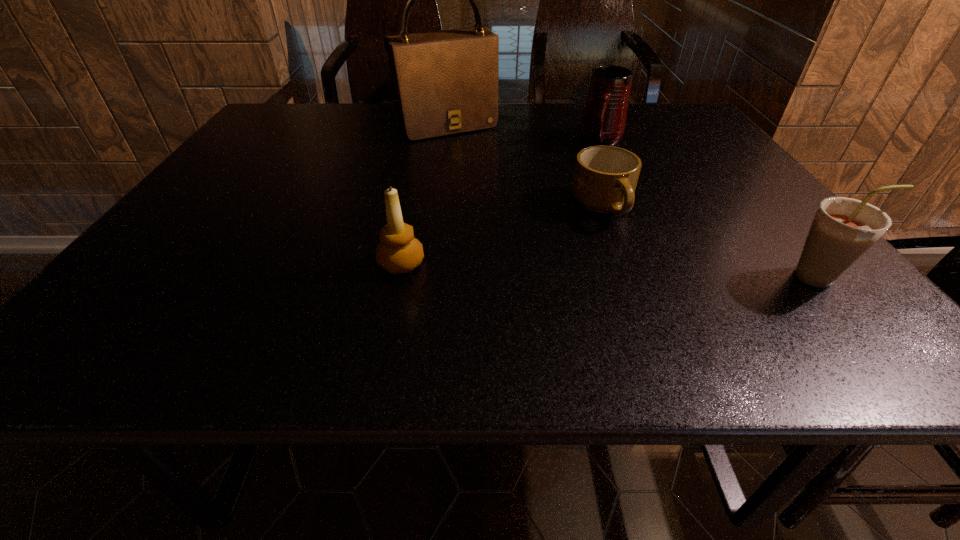
Locate an element on the screen. free space on the desktop that is between the candle_holder and the rightmost object and is positioned on the side of the taller mug with the handle is located at coordinates pyautogui.click(x=550, y=268).

Identify the location of vacant space on the desktop that is between the candle_holder and the rightmost object and is positioned on the side with the handle of the shorter mug. This screenshot has height=540, width=960. (630, 271).

Identify the location of free space on the desktop that is between the candle_holder and the rightmost object and is positioned on the front flap of the shoulder bag. This screenshot has width=960, height=540. (561, 269).